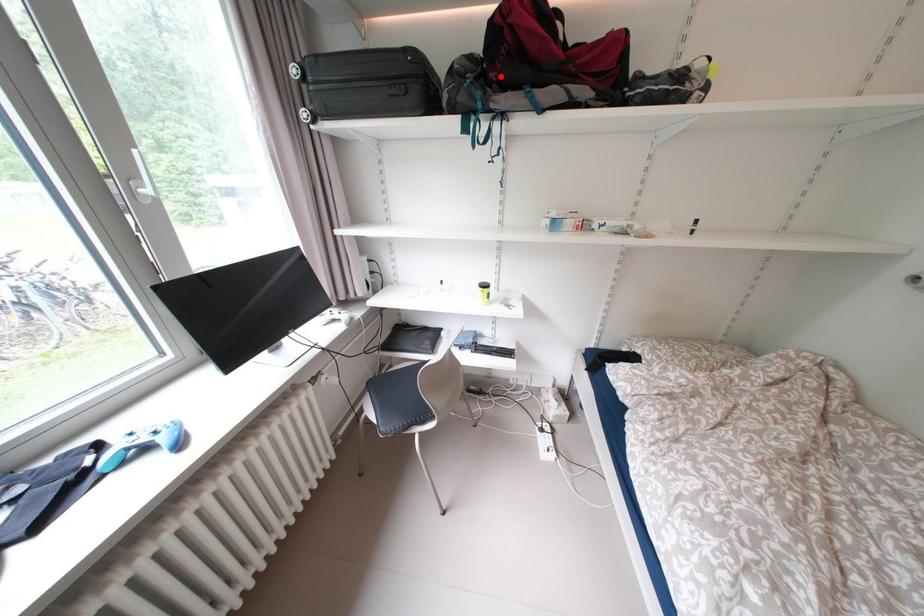
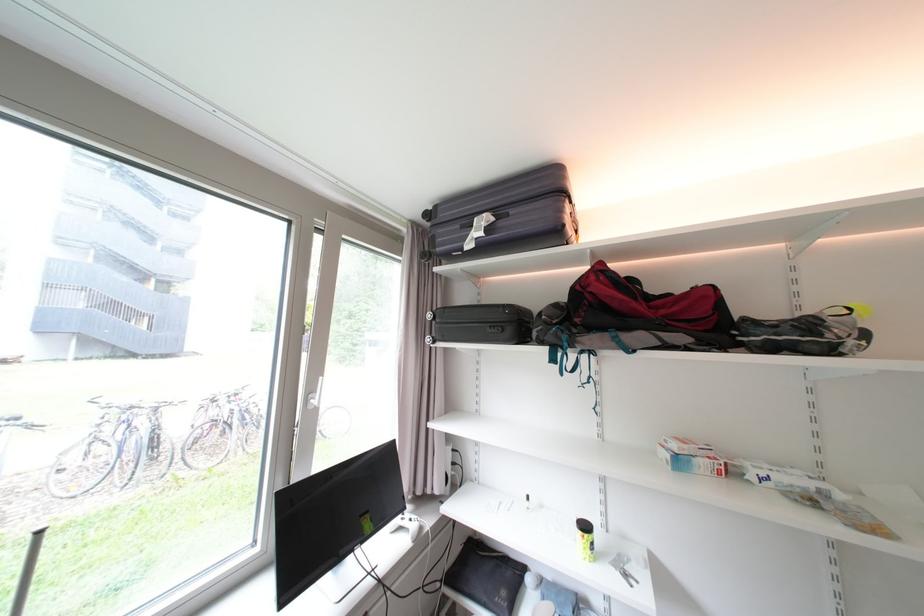
The point at the highlighted location is marked in the first image. Where is the corresponding point in the second image?

(585, 322)